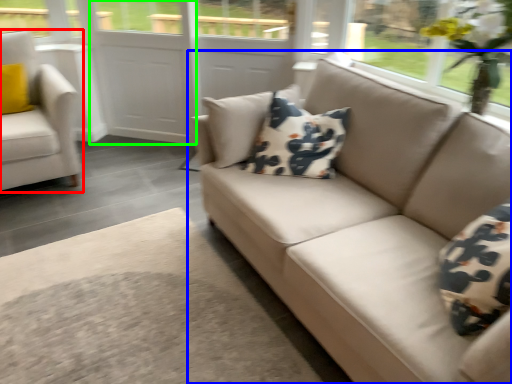
Question: Estimate the real-world distances between objects in this image. Which object is farther from chair (highlighted by a red box), studio couch (highlighted by a blue box) or screen door (highlighted by a green box)?

Choices:
 (A) studio couch
 (B) screen door

Answer: (A)